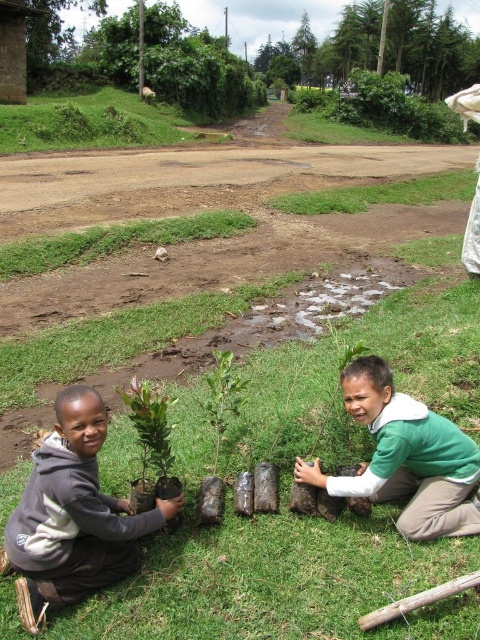
Question: Which point is farther from the camera taking this photo?

Choices:
 (A) (146, 428)
 (B) (224, 376)
 (C) (347, 496)

Answer: (B)

Question: Does green grass at center have a greater width compared to dark gray hoodie at lower left?

Choices:
 (A) no
 (B) yes

Answer: (B)

Question: Does dark gray hoodie at lower left appear on the right side of green leafy plant at center?

Choices:
 (A) no
 (B) yes

Answer: (A)

Question: Among these objects, which one is farthest from the camera?

Choices:
 (A) green leafy tree at upper center
 (B) green matte plant at lower center

Answer: (A)

Question: Is green matte plant at lower center below green leafy tree at upper center?

Choices:
 (A) no
 (B) yes

Answer: (B)

Question: Which point appears farthest from the camera in this image?

Choices:
 (A) (359, 356)
 (B) (210, 372)
 (C) (271, 77)
 (D) (137, 392)

Answer: (C)